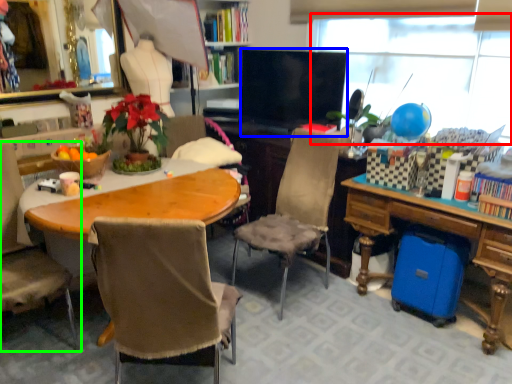
Question: Which object is positioned closest to window screen (highlighted by a red box)? Select from television (highlighted by a blue box) and chair (highlighted by a green box).

Choices:
 (A) television
 (B) chair

Answer: (A)